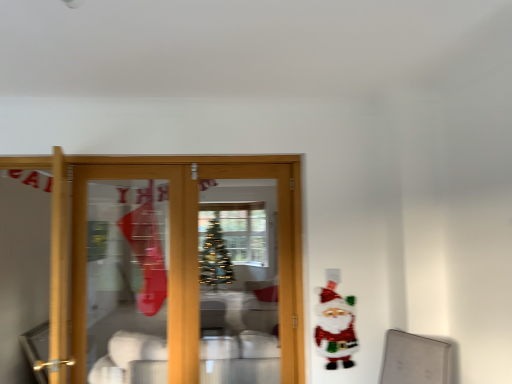
Question: From the image's perspective, relative to shiny sequined santa claus at right, is white glossy bowls at center above or below?

Choices:
 (A) above
 (B) below

Answer: (B)

Question: Based on their sizes in the image, would you say white glossy bowls at center is bigger or smaller than shiny sequined santa claus at right?

Choices:
 (A) small
 (B) big

Answer: (B)

Question: Does point (119, 364) appear closer or farther from the camera than point (347, 364)?

Choices:
 (A) closer
 (B) farther

Answer: (B)

Question: Looking at their shapes, would you say shiny sequined santa claus at right is wider or thinner than white glossy bowls at center?

Choices:
 (A) wide
 (B) thin

Answer: (B)

Question: Is shiny sequined santa claus at right bigger or smaller than white glossy bowls at center?

Choices:
 (A) small
 (B) big

Answer: (A)

Question: From a real-world perspective, is shiny sequined santa claus at right positioned above or below white glossy bowls at center?

Choices:
 (A) below
 (B) above

Answer: (B)

Question: Relative to white glossy bowls at center, is shiny sequined santa claus at right in front or behind?

Choices:
 (A) behind
 (B) front

Answer: (B)